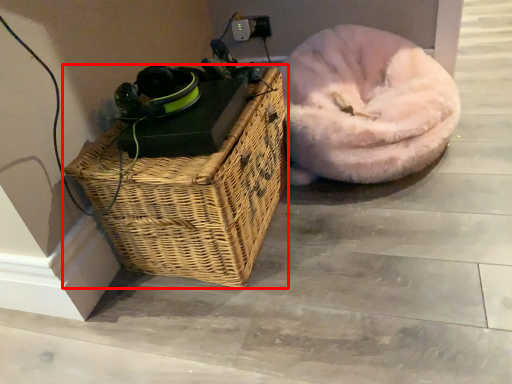
Question: Considering the relative positions of picnic basket (annotated by the red box) and dog bed in the image provided, where is picnic basket (annotated by the red box) located with respect to the staircase?

Choices:
 (A) right
 (B) left

Answer: (B)